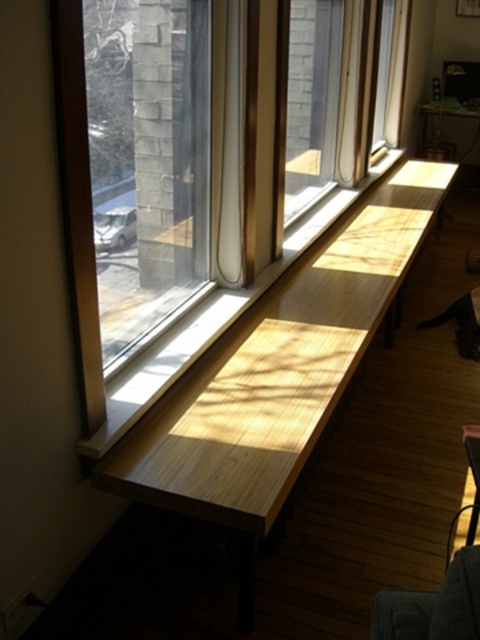
Can you confirm if transparent glass window at center is smaller than dark gray fabric armchair at lower right?

No, transparent glass window at center is not smaller than dark gray fabric armchair at lower right.

Can you confirm if transparent glass window at center is thinner than dark gray fabric armchair at lower right?

No, transparent glass window at center is not thinner than dark gray fabric armchair at lower right.

Between point (332, 77) and point (456, 589), which one is positioned behind?

Positioned behind is point (332, 77).

At what (x,y) coordinates should I click in order to perform the action: click on transparent glass window at center. Please return your answer as a coordinate pair (x, y). Looking at the image, I should click on (212, 186).

Does transparent glass window at center come behind natural wood bench at center?

No, it is in front of natural wood bench at center.

How distant is transparent glass window at center from natural wood bench at center?

16.99 inches

Who is more forward, (277,253) or (235,481)?

Positioned in front is point (235,481).

Identify the location of transparent glass window at center. This screenshot has height=640, width=480. (212, 186).

Looking at this image, which of these two, natural wood bench at center or dark gray fabric armchair at lower right, stands taller?

natural wood bench at center is taller.

Which of these two, natural wood bench at center or dark gray fabric armchair at lower right, stands shorter?

Standing shorter between the two is dark gray fabric armchair at lower right.

Which is in front, point (350, 248) or point (430, 628)?

Point (430, 628) is in front.

Identify the location of natural wood bench at center. This screenshot has height=640, width=480. (276, 374).